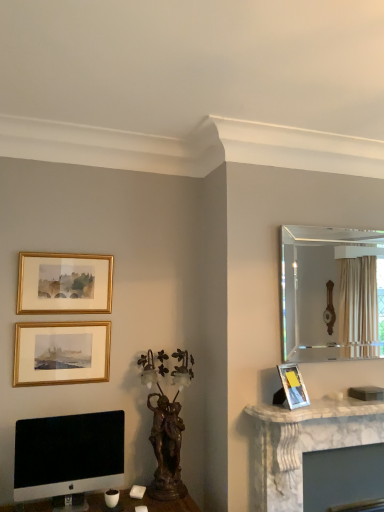
Where is `vacant space underneath gold framed picture at upper left, the 1th picture frame positioned from the top (from a real-world perspective)`? This screenshot has height=512, width=384. vacant space underneath gold framed picture at upper left, the 1th picture frame positioned from the top (from a real-world perspective) is located at coordinates (69, 315).